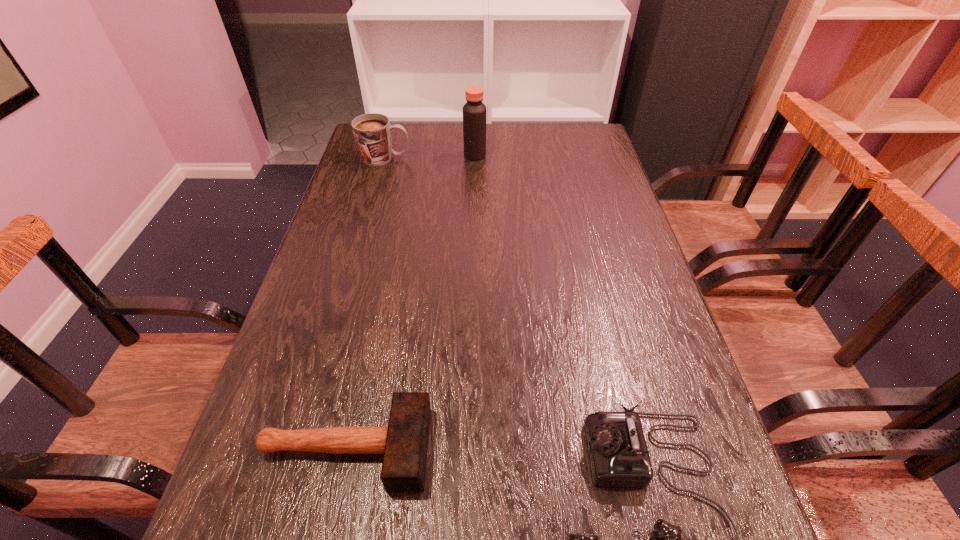
I want to click on vinegar, so click(x=474, y=111).

Image resolution: width=960 pixels, height=540 pixels. In order to click on the tallest object in this screenshot , I will do `click(474, 111)`.

Where is `mug`? The image size is (960, 540). mug is located at coordinates (372, 132).

Where is `mallet`? The height and width of the screenshot is (540, 960). mallet is located at coordinates (404, 443).

Locate an element on the screen. vacant region located on the left of the tallest object is located at coordinates (424, 155).

The width and height of the screenshot is (960, 540). Identify the location of vacant region located on the side of the third shortest object with the handle. (432, 158).

Where is `free location located on the hammer head face of the shortest object`? The width and height of the screenshot is (960, 540). free location located on the hammer head face of the shortest object is located at coordinates click(583, 448).

The width and height of the screenshot is (960, 540). Find the location of `vinegar at the far edge`. vinegar at the far edge is located at coordinates (474, 111).

The image size is (960, 540). I want to click on mug that is at the far edge, so click(x=372, y=132).

The width and height of the screenshot is (960, 540). Identify the location of mug that is at the left edge. (372, 132).